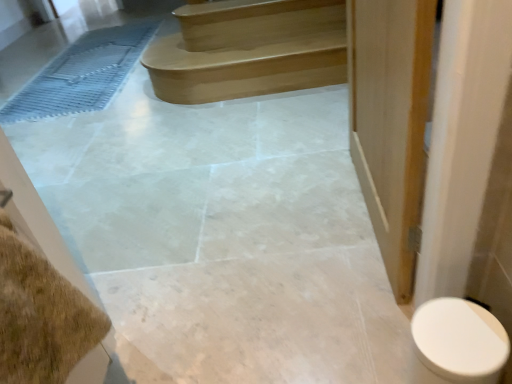
Question: In terms of height, does white glossy toilet at lower right look taller or shorter compared to satin wood stairs at upper center?

Choices:
 (A) tall
 (B) short

Answer: (A)

Question: From the image's perspective, relative to satin wood stairs at upper center, is white glossy toilet at lower right above or below?

Choices:
 (A) above
 (B) below

Answer: (B)

Question: Estimate the real-world distances between objects in this image. Which object is farther from the blue rubber bath mat at left?

Choices:
 (A) satin wood stairs at upper center
 (B) white glossy toilet at lower right

Answer: (B)

Question: Estimate the real-world distances between objects in this image. Which object is closer to the white glossy toilet at lower right?

Choices:
 (A) satin wood stairs at upper center
 (B) blue rubber bath mat at left

Answer: (A)